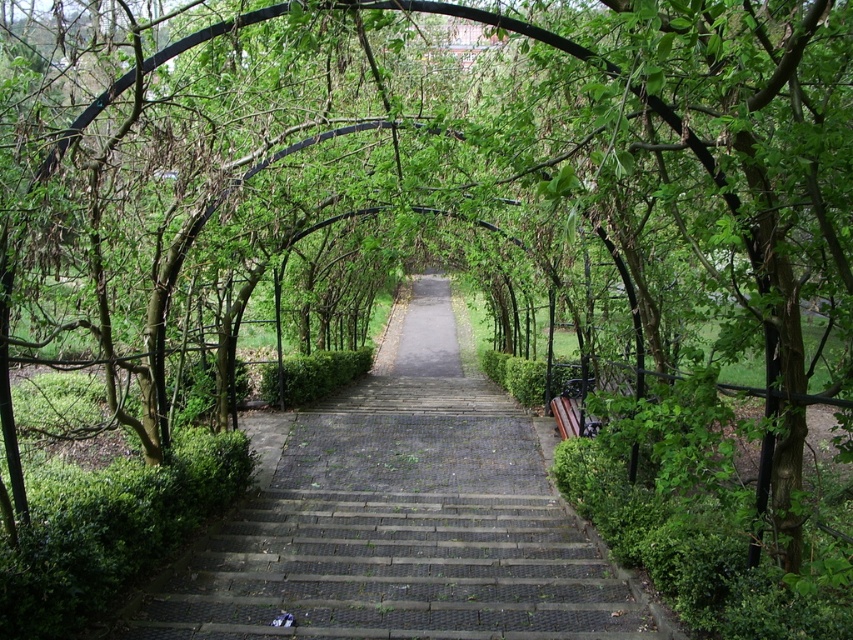
Can you confirm if dark gray cobblestone stairs at center is bigger than wooden bench at right?

Correct, dark gray cobblestone stairs at center is larger in size than wooden bench at right.

I want to click on dark gray cobblestone stairs at center, so click(x=405, y=515).

You are a GUI agent. You are given a task and a screenshot of the screen. Output one action in this format:
    pyautogui.click(x=<x>, y=<y>)
    Task: Click on the dark gray cobblestone stairs at center
    This screenshot has width=853, height=640.
    Given the screenshot: What is the action you would take?
    pyautogui.click(x=405, y=515)